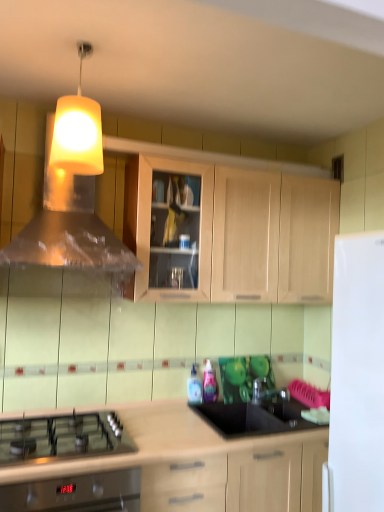
Where is `free location to the left of transparent glass tap at center`? The image size is (384, 512). free location to the left of transparent glass tap at center is located at coordinates (256, 406).